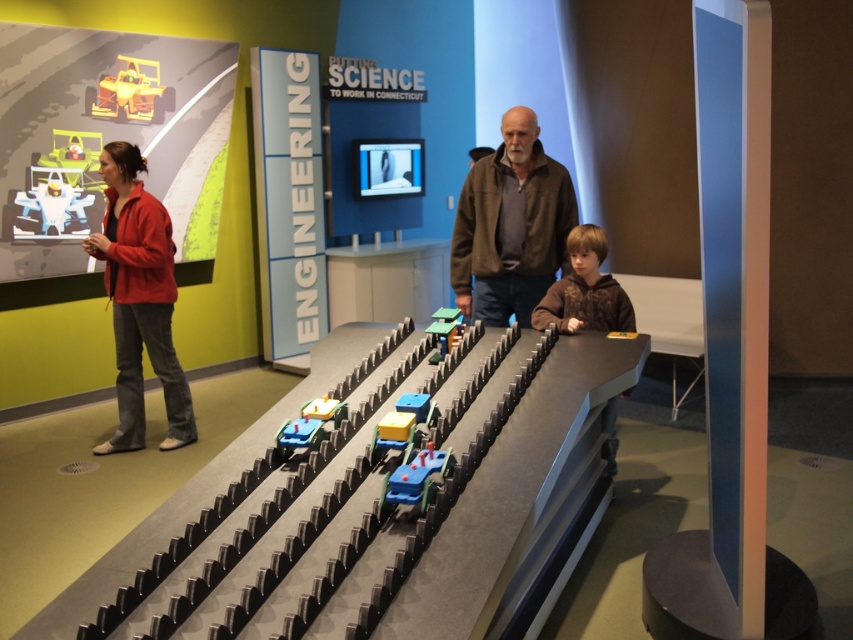
You are a visitor standing at the entrance of the science museum exhibit. You see two points marked on the curved track in front of you. The first point is at coordinates point [621,298] and the second is at point [386,483]. Which point is closer to you as you stand at the entrance?

Point [621,298] is closer to you because it is further to the viewer than point [386,483], meaning it appears nearer in the exhibit layout.

You are a visitor at the science museum and see the brown suede jacket at center and the yellow plastic toy car at upper left. Which object takes up more space in the image?

The brown suede jacket at center has a larger size compared to the yellow plastic toy car at upper left, so it takes up more space in the image.

You are a parent standing at the entrance of the science museum exhibit. You see your child wearing a brown fuzzy hoodie at center and a blue plastic toy car at center nearby. If you want to hand the toy car to your child, can you reach them without moving from your current position?

The distance between the brown fuzzy hoodie at center and the blue plastic toy car at center is 4.77 feet. Since this distance is greater than an average person arm length of about 2.5 feet, you cannot reach the toy car without moving closer.